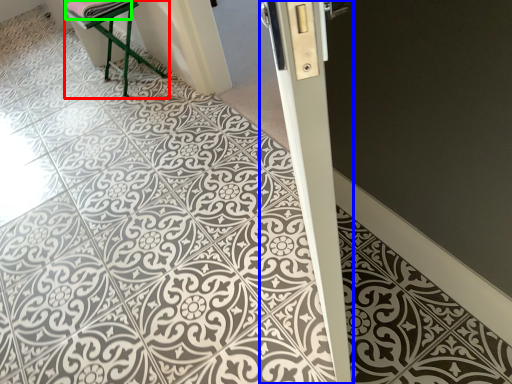
Question: Which object is positioned farthest from furniture (highlighted by a red box)? Select from pillar (highlighted by a blue box) and material (highlighted by a green box).

Choices:
 (A) pillar
 (B) material

Answer: (A)